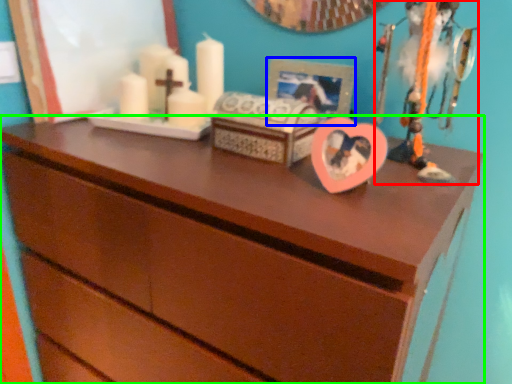
Question: Which object is positioned farthest from toy (highlighted by a red box)? Select from picture frame (highlighted by a blue box) and chest of drawers (highlighted by a green box).

Choices:
 (A) picture frame
 (B) chest of drawers

Answer: (B)